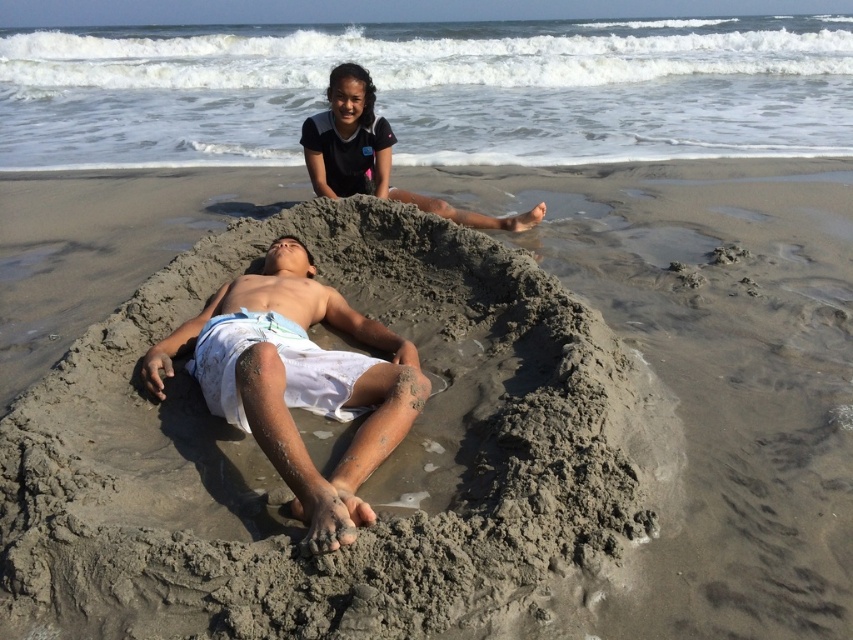
Does white sand man at center have a lesser height compared to dark blue fabric at upper center?

No, white sand man at center is not shorter than dark blue fabric at upper center.

Which is below, white sand man at center or dark blue fabric at upper center?

Positioned lower is white sand man at center.

Is point (322, 512) less distant than point (347, 177)?

Yes, it is in front of point (347, 177).

Locate an element on the screen. The height and width of the screenshot is (640, 853). white sand man at center is located at coordinates (299, 381).